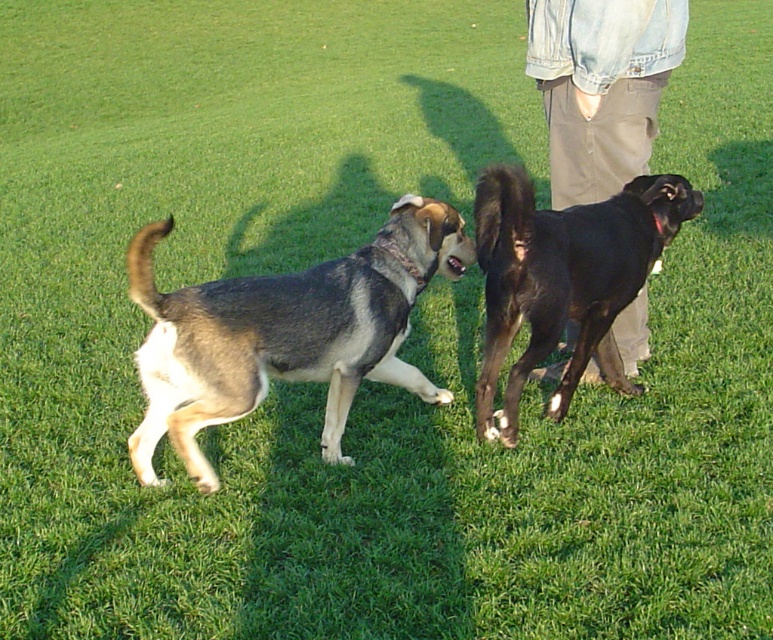
Question: Can you confirm if gray-furred dog at center is positioned above khaki pants at center?

Choices:
 (A) yes
 (B) no

Answer: (B)

Question: Is gray-furred dog at center further to the viewer compared to black glossy dog at right?

Choices:
 (A) yes
 (B) no

Answer: (B)

Question: Based on their relative distances, which object is nearer to the khaki pants at center?

Choices:
 (A) black glossy dog at right
 (B) gray-furred dog at center

Answer: (A)

Question: Is gray-furred dog at center further to camera compared to black glossy dog at right?

Choices:
 (A) no
 (B) yes

Answer: (A)

Question: Which of the following is the closest to the observer?

Choices:
 (A) gray-furred dog at center
 (B) khaki pants at center

Answer: (A)

Question: Among these points, which one is farthest from the camera?

Choices:
 (A) (308, 332)
 (B) (569, 172)
 (C) (605, 275)

Answer: (B)